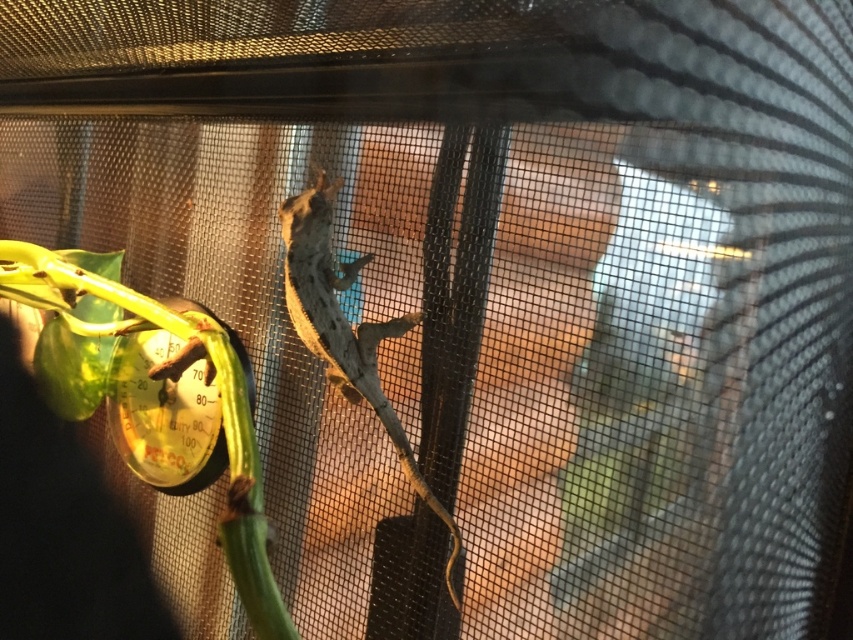
Question: Considering the relative positions of green leafy plant at left and smooth gray lizard at center in the image provided, where is green leafy plant at left located with respect to smooth gray lizard at center?

Choices:
 (A) below
 (B) above

Answer: (B)

Question: Considering the relative positions of green leafy plant at left and smooth gray lizard at center in the image provided, where is green leafy plant at left located with respect to smooth gray lizard at center?

Choices:
 (A) above
 (B) below

Answer: (A)

Question: Does green leafy plant at left have a larger size compared to smooth gray lizard at center?

Choices:
 (A) yes
 (B) no

Answer: (A)